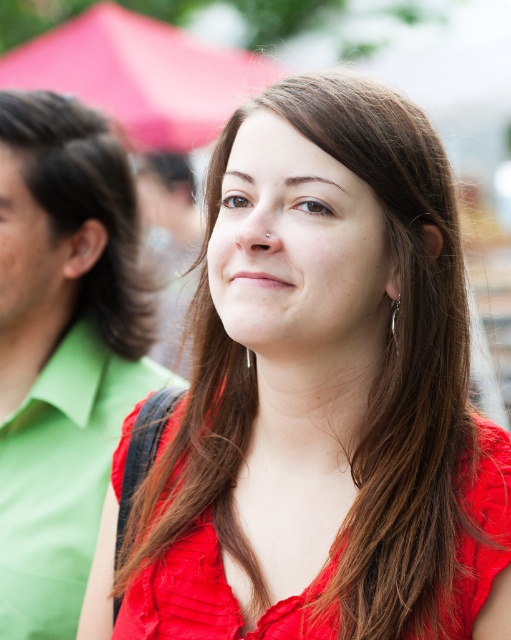
Question: Considering the real-world distances, which object is closest to the dark brown silky hair at left?

Choices:
 (A) matte red dress at center
 (B) green matte shirt at left

Answer: (B)

Question: Which point appears farthest from the camera in this image?

Choices:
 (A) (391, 332)
 (B) (52, 164)

Answer: (B)

Question: Is matte red dress at center above dark brown silky hair at left?

Choices:
 (A) yes
 (B) no

Answer: (B)

Question: In this image, where is matte red dress at center located relative to silver metallic earring at right?

Choices:
 (A) above
 (B) below

Answer: (B)

Question: Which object is closer to the camera taking this photo?

Choices:
 (A) dark brown silky hair at left
 (B) silver metallic earring at right

Answer: (B)

Question: Can you confirm if matte red dress at center is positioned above silver metallic earring at right?

Choices:
 (A) yes
 (B) no

Answer: (B)